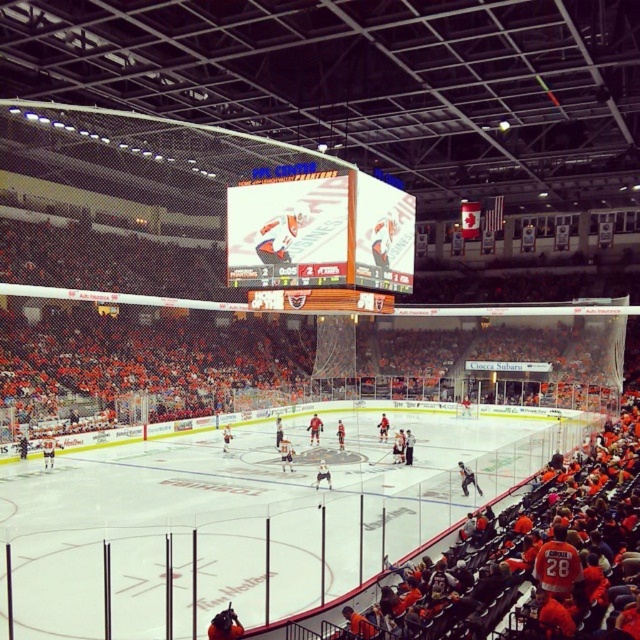
Question: Which is farther from the white ice at center?

Choices:
 (A) white glossy jersey at center
 (B) orange jersey at center

Answer: (B)

Question: Which point is closer to the camera?

Choices:
 (A) white glossy jersey at center
 (B) wooden scoreboard at center

Answer: (B)

Question: Can you confirm if shiny black jersey at center is positioned below white glossy jersey at center?

Choices:
 (A) no
 (B) yes

Answer: (A)

Question: Considering the relative positions of wooden scoreboard at center and orange jersey at center in the image provided, where is wooden scoreboard at center located with respect to orange jersey at center?

Choices:
 (A) left
 (B) right

Answer: (B)

Question: Does wooden scoreboard at center appear on the right side of white glossy jersey at center?

Choices:
 (A) yes
 (B) no

Answer: (A)

Question: Which point is closer to the camera?

Choices:
 (A) (477, 492)
 (B) (282, 467)
 (C) (323, 472)
 (D) (291, 180)

Answer: (D)